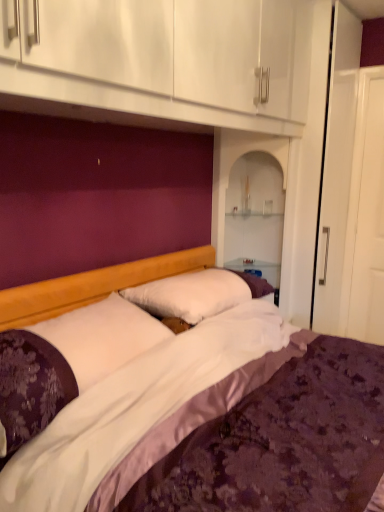
Image resolution: width=384 pixels, height=512 pixels. Describe the element at coordinates (196, 295) in the screenshot. I see `white soft pillow at center, marked as the first pillow in a back-to-front arrangement` at that location.

At what (x,y) coordinates should I click in order to perform the action: click on white soft pillow at center, marked as the first pillow in a back-to-front arrangement. Please return your answer as a coordinate pair (x, y). The width and height of the screenshot is (384, 512). Looking at the image, I should click on (196, 295).

The height and width of the screenshot is (512, 384). What do you see at coordinates (67, 361) in the screenshot?
I see `white satin pillow at center, which is counted as the second pillow, starting from the back` at bounding box center [67, 361].

Where is `white satin pillow at center, which is counted as the second pillow, starting from the back`? white satin pillow at center, which is counted as the second pillow, starting from the back is located at coordinates click(67, 361).

Where is `white soft pillow at center, the 2th pillow when ordered from front to back`? This screenshot has height=512, width=384. white soft pillow at center, the 2th pillow when ordered from front to back is located at coordinates (196, 295).

Between white satin pillow at center, which is the first pillow from front to back, and white soft pillow at center, the 2th pillow when ordered from front to back, which one appears on the left side from the viewer's perspective?

Positioned to the left is white satin pillow at center, which is the first pillow from front to back.

Which object is closer to the camera taking this photo, white satin pillow at center, which is the first pillow from front to back, or white soft pillow at center, the 2th pillow when ordered from front to back?

white satin pillow at center, which is the first pillow from front to back, is more forward.

Is point (86, 382) in front of point (181, 297)?

Yes, it is in front of point (181, 297).

From the image's perspective, between white satin pillow at center, which is counted as the second pillow, starting from the back, and white soft pillow at center, marked as the first pillow in a back-to-front arrangement, which one is located above?

white soft pillow at center, marked as the first pillow in a back-to-front arrangement.

From the picture: From a real-world perspective, which object rests below the other?

white satin pillow at center, which is the first pillow from front to back.

Does white satin pillow at center, which is counted as the second pillow, starting from the back, have a greater width compared to white soft pillow at center, marked as the first pillow in a back-to-front arrangement?

Yes.

Between white satin pillow at center, which is the first pillow from front to back, and white soft pillow at center, the 2th pillow when ordered from front to back, which one has more height?

white satin pillow at center, which is the first pillow from front to back, is taller.

Which of these two, white satin pillow at center, which is counted as the second pillow, starting from the back, or white soft pillow at center, marked as the first pillow in a back-to-front arrangement, is smaller?

white soft pillow at center, marked as the first pillow in a back-to-front arrangement, is smaller.

Which is correct: white satin pillow at center, which is counted as the second pillow, starting from the back, is inside white soft pillow at center, the 2th pillow when ordered from front to back, or outside of it?

white satin pillow at center, which is counted as the second pillow, starting from the back, is spatially situated outside white soft pillow at center, the 2th pillow when ordered from front to back.

Is white satin pillow at center, which is counted as the second pillow, starting from the back, next to white soft pillow at center, marked as the first pillow in a back-to-front arrangement, and touching it?

white satin pillow at center, which is counted as the second pillow, starting from the back, and white soft pillow at center, marked as the first pillow in a back-to-front arrangement, are not in contact.

Is white soft pillow at center, marked as the first pillow in a back-to-front arrangement, at the back of white satin pillow at center, which is counted as the second pillow, starting from the back?

No, white soft pillow at center, marked as the first pillow in a back-to-front arrangement, is not at the back of white satin pillow at center, which is counted as the second pillow, starting from the back.

Could you measure the distance between white satin pillow at center, which is counted as the second pillow, starting from the back, and white soft pillow at center, the 2th pillow when ordered from front to back?

white satin pillow at center, which is counted as the second pillow, starting from the back, and white soft pillow at center, the 2th pillow when ordered from front to back, are 16.13 inches apart.

Image resolution: width=384 pixels, height=512 pixels. I want to click on pillow beneath the white soft pillow at center, the 2th pillow when ordered from front to back (from a real-world perspective), so click(67, 361).

Considering the relative positions of white soft pillow at center, the 2th pillow when ordered from front to back, and white satin pillow at center, which is the first pillow from front to back, in the image provided, is white soft pillow at center, the 2th pillow when ordered from front to back, to the left of white satin pillow at center, which is the first pillow from front to back, from the viewer's perspective?

No.

Does white soft pillow at center, the 2th pillow when ordered from front to back, lie behind white satin pillow at center, which is counted as the second pillow, starting from the back?

Yes, it is behind white satin pillow at center, which is counted as the second pillow, starting from the back.

Which is in front, point (185, 275) or point (3, 394)?

Positioned in front is point (3, 394).

From the image's perspective, is white soft pillow at center, the 2th pillow when ordered from front to back, on white satin pillow at center, which is counted as the second pillow, starting from the back?

Yes, from the image's perspective, white soft pillow at center, the 2th pillow when ordered from front to back, is on top of white satin pillow at center, which is counted as the second pillow, starting from the back.

From a real-world perspective, does white soft pillow at center, the 2th pillow when ordered from front to back, sit lower than white satin pillow at center, which is counted as the second pillow, starting from the back?

Actually, white soft pillow at center, the 2th pillow when ordered from front to back, is physically above white satin pillow at center, which is counted as the second pillow, starting from the back, in the real world.

Considering the relative sizes of white soft pillow at center, marked as the first pillow in a back-to-front arrangement, and white satin pillow at center, which is the first pillow from front to back, in the image provided, is white soft pillow at center, marked as the first pillow in a back-to-front arrangement, thinner than white satin pillow at center, which is the first pillow from front to back,?

Yes, white soft pillow at center, marked as the first pillow in a back-to-front arrangement, is thinner than white satin pillow at center, which is the first pillow from front to back.

Who is taller, white soft pillow at center, the 2th pillow when ordered from front to back, or white satin pillow at center, which is counted as the second pillow, starting from the back?

white satin pillow at center, which is counted as the second pillow, starting from the back, is taller.

Which of these two, white soft pillow at center, marked as the first pillow in a back-to-front arrangement, or white satin pillow at center, which is the first pillow from front to back, is smaller?

white soft pillow at center, marked as the first pillow in a back-to-front arrangement.

Is white satin pillow at center, which is counted as the second pillow, starting from the back, a part of white soft pillow at center, the 2th pillow when ordered from front to back?

Actually, white satin pillow at center, which is counted as the second pillow, starting from the back, is outside white soft pillow at center, the 2th pillow when ordered from front to back.

Does white soft pillow at center, the 2th pillow when ordered from front to back, touch white satin pillow at center, which is counted as the second pillow, starting from the back?

white soft pillow at center, the 2th pillow when ordered from front to back, and white satin pillow at center, which is counted as the second pillow, starting from the back, are not in contact.

Is white soft pillow at center, marked as the first pillow in a back-to-front arrangement, looking in the opposite direction of white satin pillow at center, which is counted as the second pillow, starting from the back?

No, white soft pillow at center, marked as the first pillow in a back-to-front arrangement, is not facing the opposite direction of white satin pillow at center, which is counted as the second pillow, starting from the back.

The image size is (384, 512). In order to click on pillow that is above the white satin pillow at center, which is counted as the second pillow, starting from the back (from a real-world perspective) in this screenshot , I will do `click(196, 295)`.

Locate an element on the screen. Image resolution: width=384 pixels, height=512 pixels. pillow in front of the white soft pillow at center, the 2th pillow when ordered from front to back is located at coordinates (67, 361).

This screenshot has width=384, height=512. I want to click on pillow that is above the white satin pillow at center, which is counted as the second pillow, starting from the back (from a real-world perspective), so click(x=196, y=295).